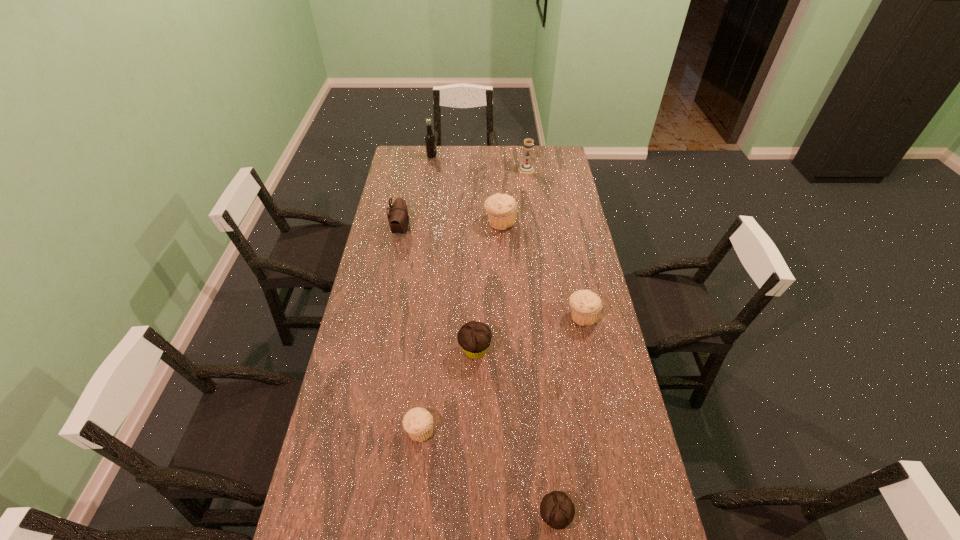
Identify the location of free space at the right edge of the desktop. (630, 457).

Locate an element on the screen. The image size is (960, 540). vacant region at the far left corner of the desktop is located at coordinates (399, 147).

Identify the location of unoccupied position between the leftmost beige muffin and the farthest object. Image resolution: width=960 pixels, height=540 pixels. (425, 293).

Image resolution: width=960 pixels, height=540 pixels. In order to click on free point between the second nearest muffin and the rightmost object in this screenshot , I will do `click(501, 373)`.

In order to click on free space between the fourth nearest muffin and the root beer in this screenshot , I will do `click(507, 237)`.

The width and height of the screenshot is (960, 540). Identify the location of free space that is in between the third object from left to right and the rightmost beige muffin. [x=501, y=373].

You are a GUI agent. You are given a task and a screenshot of the screen. Output one action in this format:
    pyautogui.click(x=<x>, y=<y>)
    Task: Click on the vacant space that's between the nearer chocolate muffin and the second beige muffin from left to right
    Image resolution: width=960 pixels, height=540 pixels.
    Given the screenshot: What is the action you would take?
    pyautogui.click(x=527, y=370)

Find the location of a particular element. The height and width of the screenshot is (540, 960). free spot between the sixth farthest object and the rightmost object is located at coordinates (529, 333).

You are a GUI agent. You are given a task and a screenshot of the screen. Output one action in this format:
    pyautogui.click(x=<x>, y=<y>)
    Task: Click on the vacant region between the biggest beige muffin and the farthest object
    
    Given the screenshot: What is the action you would take?
    pyautogui.click(x=466, y=190)

You are a GUI agent. You are given a task and a screenshot of the screen. Output one action in this format:
    pyautogui.click(x=<x>, y=<y>)
    Task: Click on the empty space between the seventh farthest object and the nearer chocolate muffin
    The height and width of the screenshot is (540, 960).
    Given the screenshot: What is the action you would take?
    pyautogui.click(x=487, y=474)